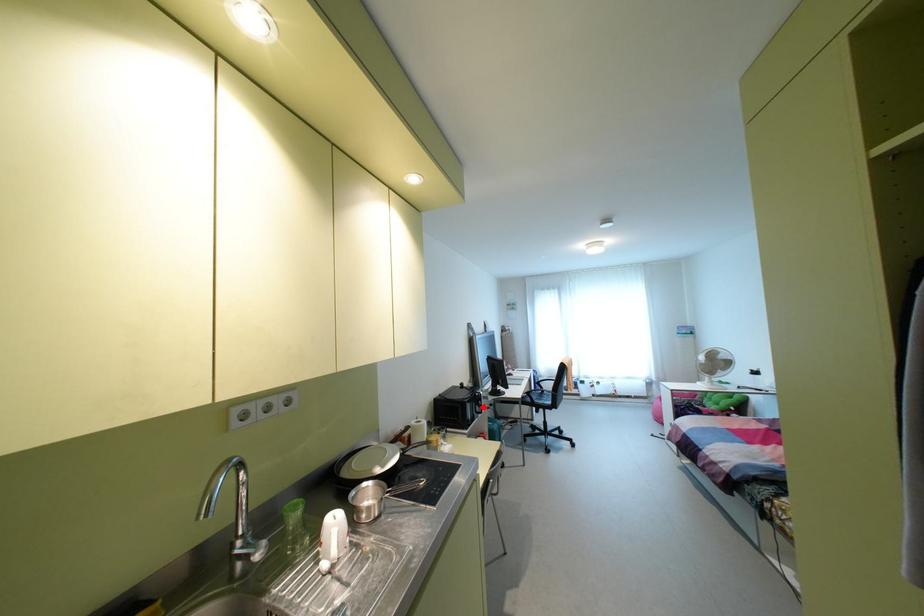
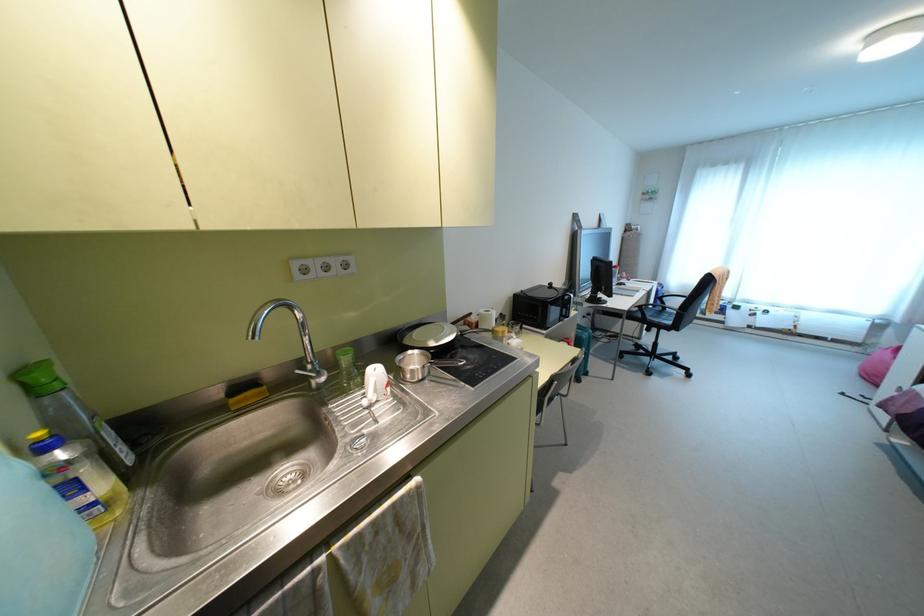
Question: I am providing you with two images of the same scene from different viewpoints. In image1, a red point is highlighted. Considering the same 3D point in image2, which of the following is correct?

Choices:
 (A) It is closer
 (B) It is farther

Answer: (A)